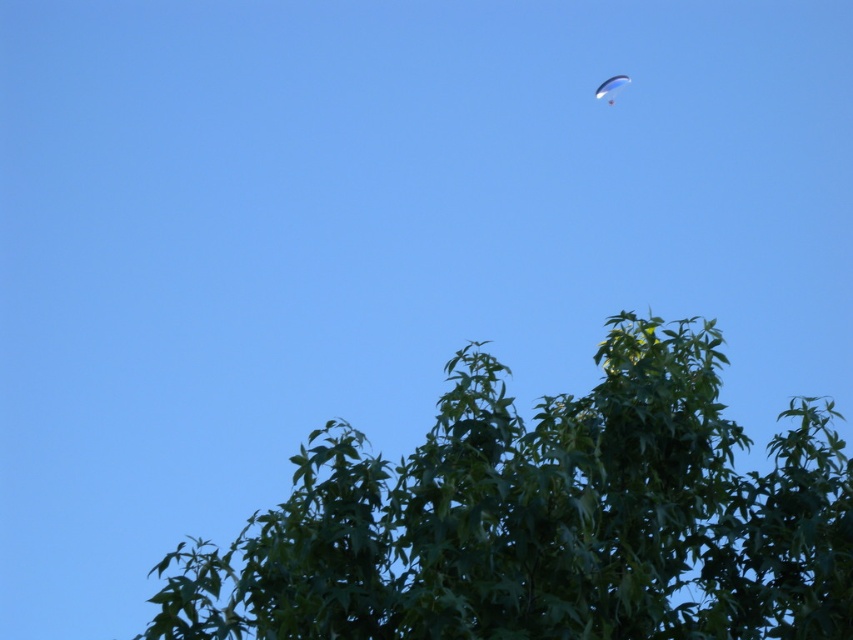
You are a bird flying at the same altitude as the white glossy parachute at upper right. You want to land on the green leafy tree at center. Can you safely descend vertically without hitting any obstacles?

The green leafy tree at center has a greater height compared to the white glossy parachute at upper right. Since the tree is taller than the parachute, you can safely descend vertically from the parachute to the tree without hitting any obstacles.

You are a bird flying at the same height as the green leafy tree at center. Can you see the white glossy parachute at upper right above you?

Yes, the green leafy tree at center is located below white glossy parachute at upper right, so the parachute is above the tree. Since you are flying at the same height as the tree, you can see the white glossy parachute at upper right above you.

From the picture: You are standing in the middle of the forest looking up at the green leafy tree at center and the white glossy parachute at upper right. Which object is closer to you?

The green leafy tree at center is closer to the viewer than the white glossy parachute at upper right.